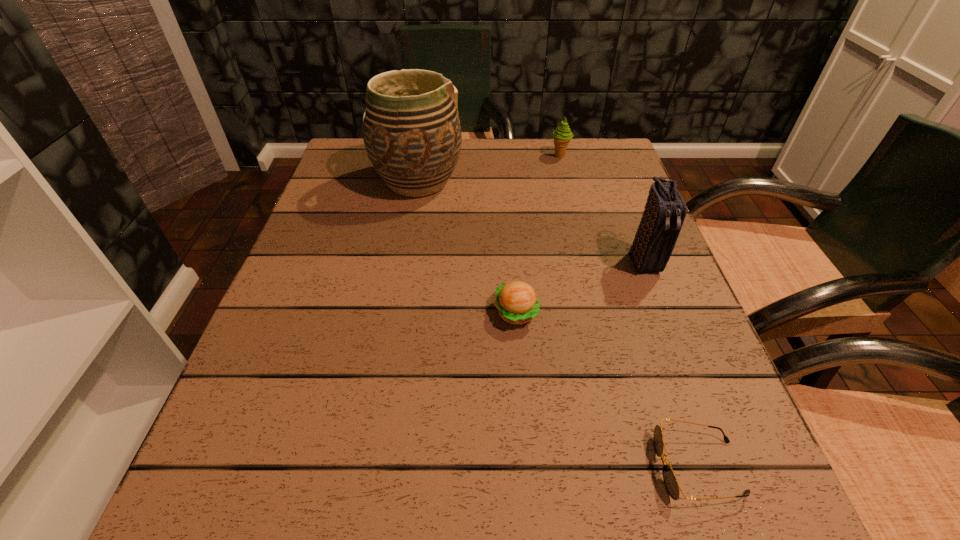
This screenshot has width=960, height=540. What are the coordinates of `vacant space that is in between the third farthest object and the third shortest object` in the screenshot? It's located at (602, 208).

You are a GUI agent. You are given a task and a screenshot of the screen. Output one action in this format:
    pyautogui.click(x=<x>, y=<y>)
    Task: Click on the vacant space in between the clutch bag and the third tallest object
    This screenshot has height=540, width=960.
    Given the screenshot: What is the action you would take?
    pyautogui.click(x=602, y=208)

The height and width of the screenshot is (540, 960). What are the coordinates of `blank region between the clutch bag and the sunglasses` in the screenshot? It's located at (671, 364).

The height and width of the screenshot is (540, 960). In order to click on vacant area that lies between the third tallest object and the pottery in this screenshot , I will do `click(489, 168)`.

Identify the location of vacant region between the second nearest object and the tallest object. This screenshot has width=960, height=540. (468, 247).

Image resolution: width=960 pixels, height=540 pixels. In order to click on free area in between the tallest object and the icecream in this screenshot , I will do `click(489, 168)`.

This screenshot has width=960, height=540. In order to click on free space between the hamburger and the icecream in this screenshot , I will do `click(538, 234)`.

I want to click on vacant point located between the icecream and the clutch bag, so click(602, 208).

You are a GUI agent. You are given a task and a screenshot of the screen. Output one action in this format:
    pyautogui.click(x=<x>, y=<y>)
    Task: Click on the free space between the icecream and the second object from left to right
    
    Given the screenshot: What is the action you would take?
    pyautogui.click(x=538, y=234)

Where is `empty location between the third shortest object and the clutch bag`? This screenshot has height=540, width=960. empty location between the third shortest object and the clutch bag is located at coordinates (602, 208).